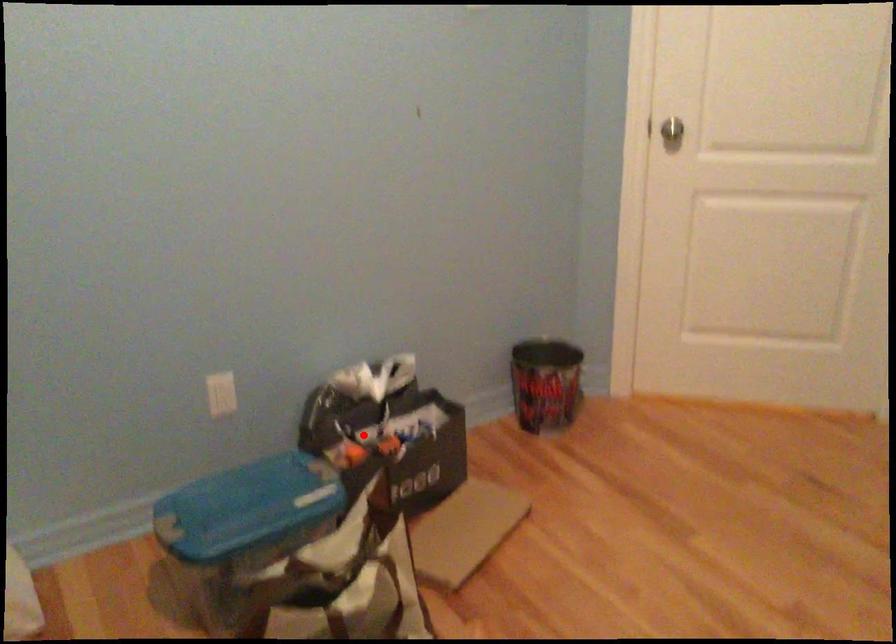
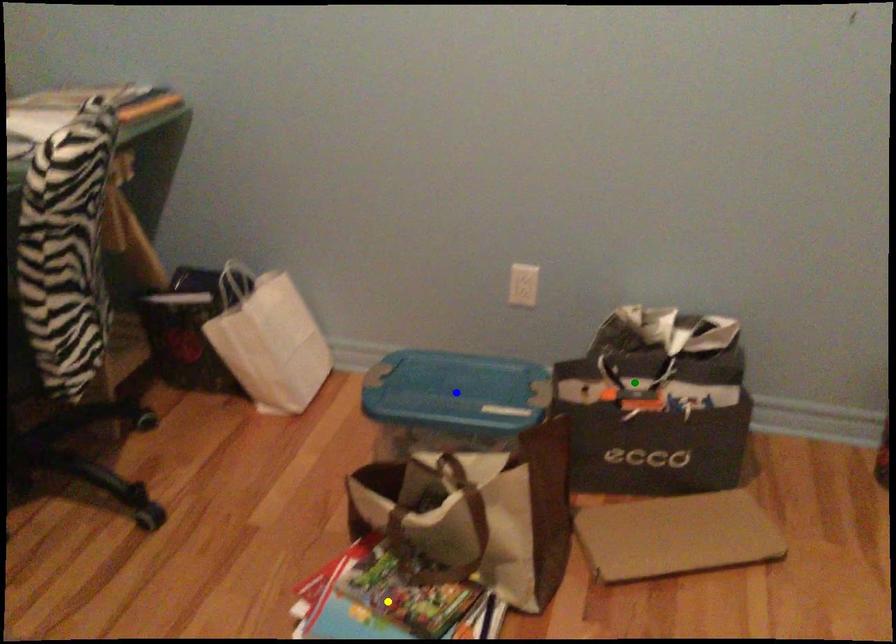
Question: I am providing you with two images of the same scene from different viewpoints. A red point is marked on the first image. You are given multiple points on the second image. Which point in image 2 represents the same 3d spot as the red point in image 1?

Choices:
 (A) blue point
 (B) yellow point
 (C) green point

Answer: (C)